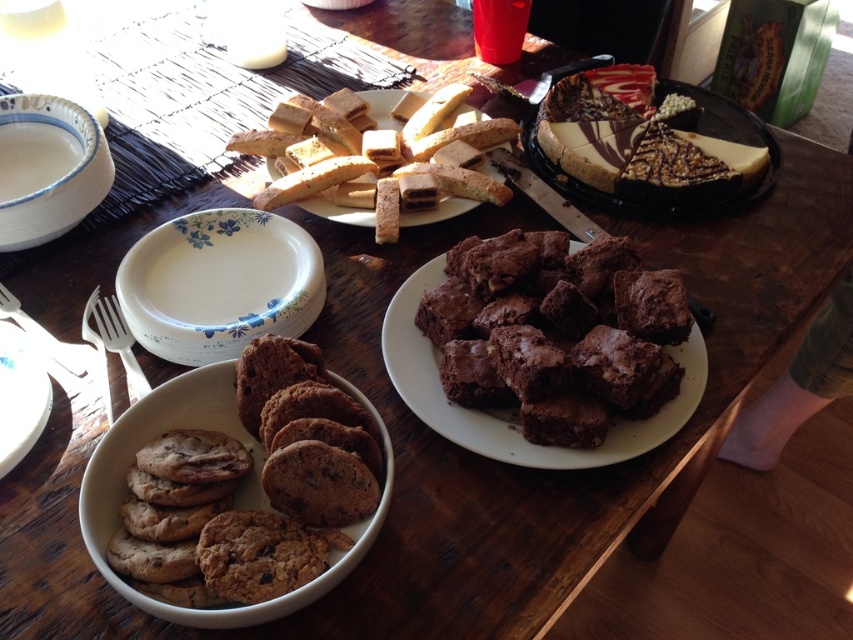
Question: Which point is closer to the camera?

Choices:
 (A) (65, 204)
 (B) (422, 356)
 (C) (213, 321)

Answer: (B)

Question: Which object is positioned farthest from the white ceramic bowl at upper left?

Choices:
 (A) chocolate matte brownies at center
 (B) golden brown crumbly biscotti at center
 (C) matte white plate at lower left
 (D) brown matte bowl at lower left

Answer: (A)

Question: Can you confirm if white ceramic bowl at upper left is positioned below golden brown crumbly biscotti at center?

Choices:
 (A) no
 (B) yes

Answer: (B)

Question: Does chocolate matte brownies at center have a smaller size compared to white ceramic bowl at upper left?

Choices:
 (A) yes
 (B) no

Answer: (B)

Question: Which of the following is the closest to the observer?

Choices:
 (A) matte white plate at lower left
 (B) golden brown crumbly biscotti at center
 (C) brown matte bowl at lower left
 (D) chocolate matte brownies at center

Answer: (C)

Question: Can you confirm if brown matte bowl at lower left is wider than golden brown crumbly biscotti at center?

Choices:
 (A) yes
 (B) no

Answer: (B)